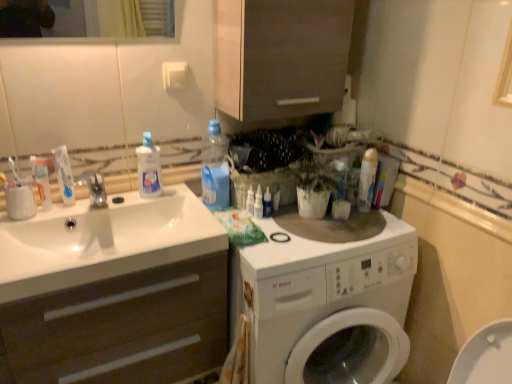
Find the location of a particular element. vacant point to the left of transparent plastic bottle at upper left, placed as the fourth cleaning product when sorted from right to left is located at coordinates (117, 203).